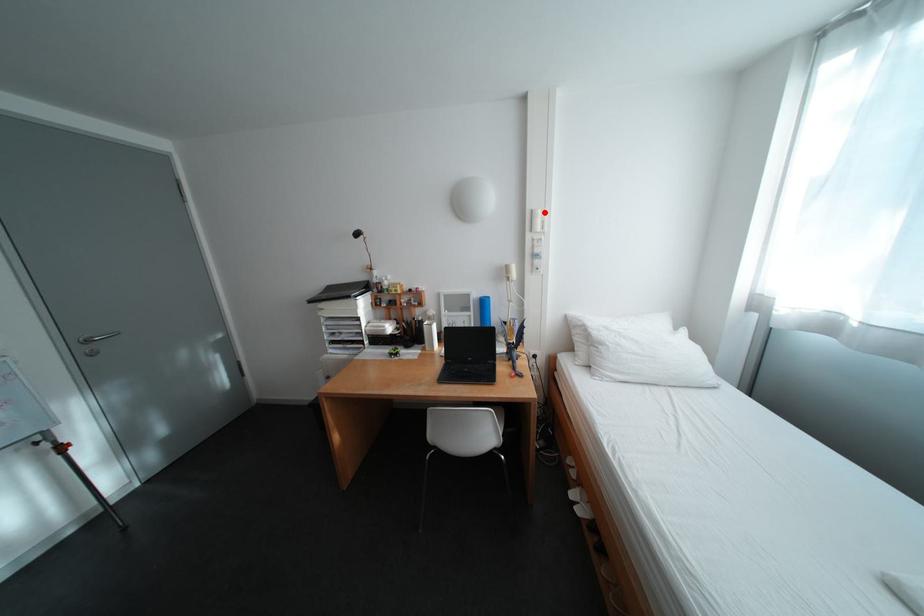
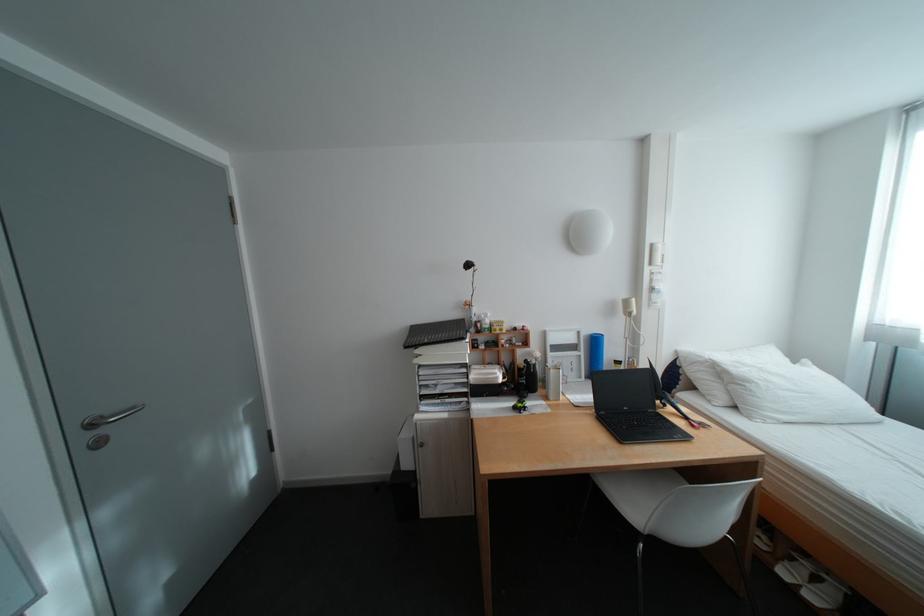
Question: I am providing you with two images of the same scene from different viewpoints. In image1, a red point is highlighted. Considering the same 3D point in image2, which of the following is correct?

Choices:
 (A) It is closer
 (B) It is farther

Answer: (B)